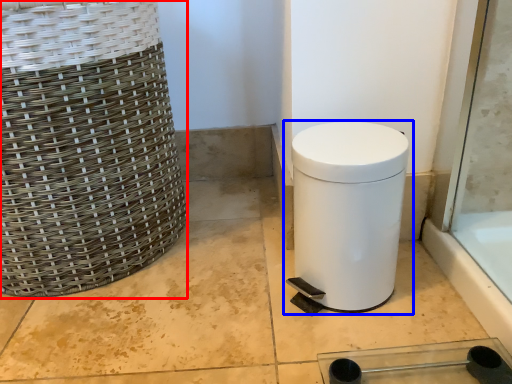
Question: Which object is closer to the camera taking this photo, basket (highlighted by a red box) or waste container (highlighted by a blue box)?

Choices:
 (A) basket
 (B) waste container

Answer: (A)